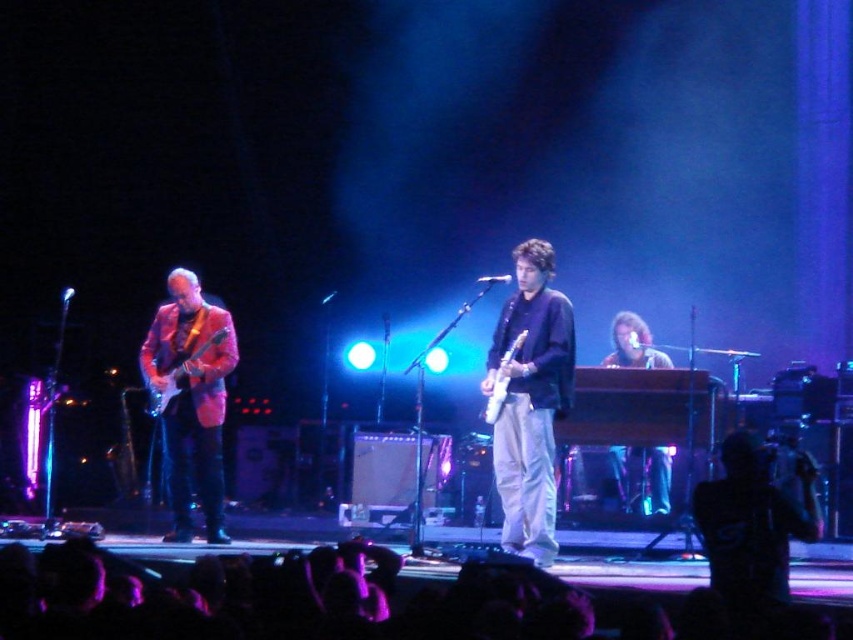
Question: Which of the following is the farthest from the observer?

Choices:
 (A) (650, 506)
 (B) (494, 401)
 (C) (543, 280)
 (D) (163, 384)

Answer: (A)

Question: Does matte black guitar at center appear on the left side of shiny pink jacket at left?

Choices:
 (A) yes
 (B) no

Answer: (B)

Question: Among these objects, which one is farthest from the camera?

Choices:
 (A) matte black guitar at center
 (B) white glossy electric guitar at center
 (C) shiny pink jacket at left

Answer: (C)

Question: Can you confirm if wooden keyboard at center is smaller than white glossy electric guitar at center?

Choices:
 (A) no
 (B) yes

Answer: (A)

Question: Which object appears farthest from the camera in this image?

Choices:
 (A) white glossy electric guitar at center
 (B) wooden keyboard at center
 (C) shiny pink jacket at left
 (D) matte black guitar at center

Answer: (B)

Question: Does wooden keyboard at center appear on the left side of shiny metallic guitar at left?

Choices:
 (A) no
 (B) yes

Answer: (A)